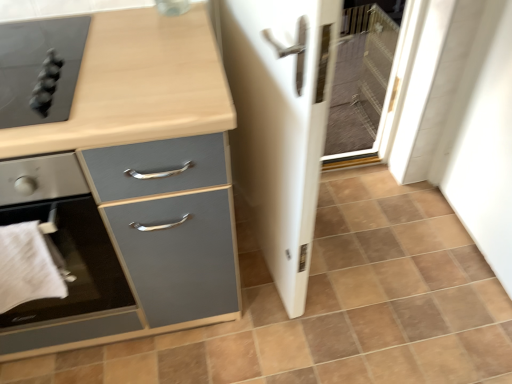
Locate an element on the screen. The image size is (512, 384). free point above matte gray cabinet at left (from a real-world perspective) is located at coordinates (104, 66).